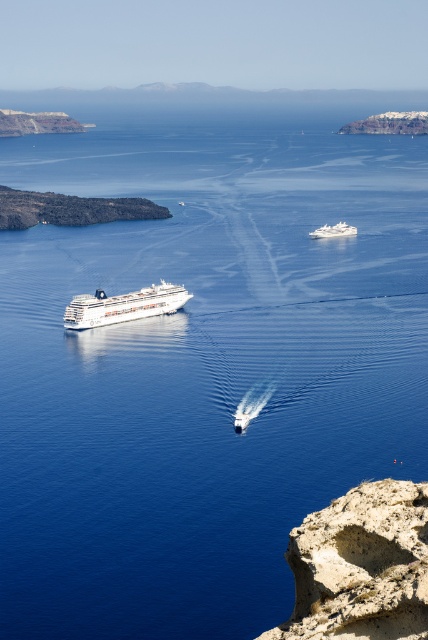
You are a marine biologist observing the white glossy cruise ship at center from a research boat. You notice another cruise ship in the distance. How far apart are the two ships?

The white glossy cruise ship at center and the other cruise ship are 638.78 meters apart.

You are a photographer planning to capture both the white glossy cruise ship at center and the white glossy yacht at upper center in a single frame. Given their sizes, which one should you focus on to ensure both are clearly visible without cropping?

The white glossy cruise ship at center is bigger than the white glossy yacht at upper center, so focusing on the cruise ship ensures both can be captured clearly without cropping.

You are standing on the rocky outcrop in the foreground of the seascape. You see two points marked on the cruise ships in the midground. Which point, point (94, 323) or point (329, 228), is closer to you?

Point (94, 323) is closer to the viewer than point (329, 228).